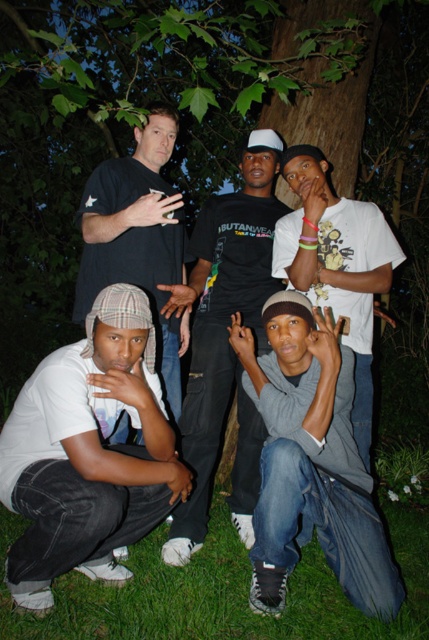
Based on the photo, can you confirm if gray cotton sweatshirt at lower center is positioned above green grass at lower center?

Yes, gray cotton sweatshirt at lower center is above green grass at lower center.

What do you see at coordinates (311, 460) in the screenshot? The height and width of the screenshot is (640, 429). I see `gray cotton sweatshirt at lower center` at bounding box center [311, 460].

I want to click on gray cotton sweatshirt at lower center, so click(311, 460).

Between white cotton shirt at lower left and white matte t-shirt at center, which one is positioned higher?

white matte t-shirt at center

Can you confirm if white cotton shirt at lower left is thinner than white matte t-shirt at center?

No.

Find the location of a particular element. This screenshot has width=429, height=640. white cotton shirt at lower left is located at coordinates (87, 452).

This screenshot has width=429, height=640. In order to click on white cotton shirt at lower left in this screenshot , I will do `click(87, 452)`.

Can you confirm if green grass at lower center is wider than black cotton t-shirt at center?

Indeed, green grass at lower center has a greater width compared to black cotton t-shirt at center.

Does green grass at lower center have a larger size compared to black cotton t-shirt at center?

No, green grass at lower center is not bigger than black cotton t-shirt at center.

Is point (208, 525) closer to viewer compared to point (241, 241)?

That is True.

Find the location of `green grass at lower center`. green grass at lower center is located at coordinates (220, 592).